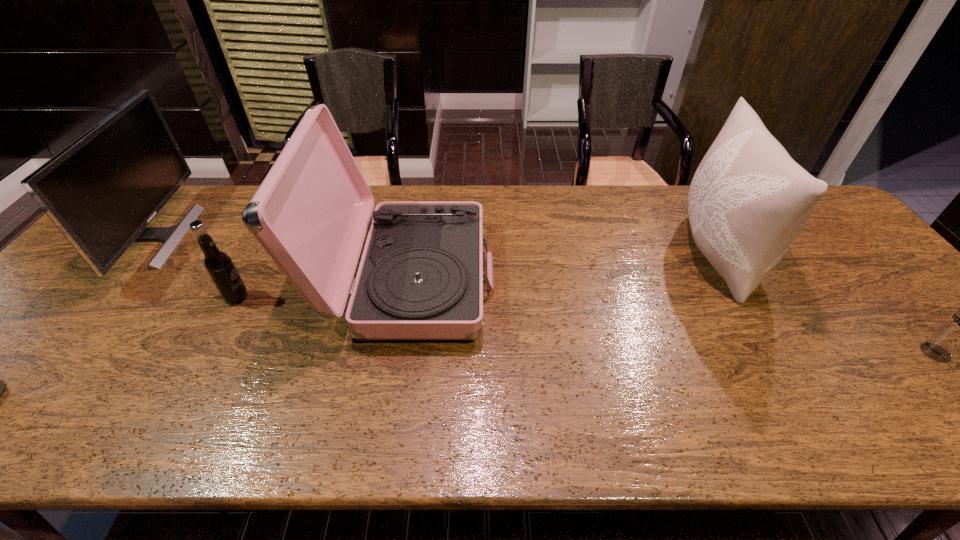
This screenshot has height=540, width=960. In order to click on record player that is at the far edge in this screenshot , I will do `click(420, 277)`.

At what (x,y) coordinates should I click in order to perform the action: click on cushion at the far edge. Please return your answer as a coordinate pair (x, y). This screenshot has height=540, width=960. Looking at the image, I should click on (748, 200).

The height and width of the screenshot is (540, 960). What are the coordinates of `monitor at the far edge` in the screenshot? It's located at (101, 191).

Where is `object present at the left edge`? The width and height of the screenshot is (960, 540). object present at the left edge is located at coordinates (101, 191).

Locate an element on the screen. The height and width of the screenshot is (540, 960). object that is at the far left corner is located at coordinates (101, 191).

Image resolution: width=960 pixels, height=540 pixels. I want to click on free space at the far edge of the desktop, so click(x=216, y=223).

In the image, there is a desktop. At what (x,y) coordinates should I click in order to perform the action: click on vacant space at the near edge. Please return your answer as a coordinate pair (x, y). The width and height of the screenshot is (960, 540). Looking at the image, I should click on (65, 439).

This screenshot has width=960, height=540. I want to click on free space at the left edge of the desktop, so click(18, 378).

In the image, there is a desktop. Find the location of `vacant space at the right edge`. vacant space at the right edge is located at coordinates (906, 341).

This screenshot has width=960, height=540. Find the location of `vacant region at the far left corner`. vacant region at the far left corner is located at coordinates (176, 215).